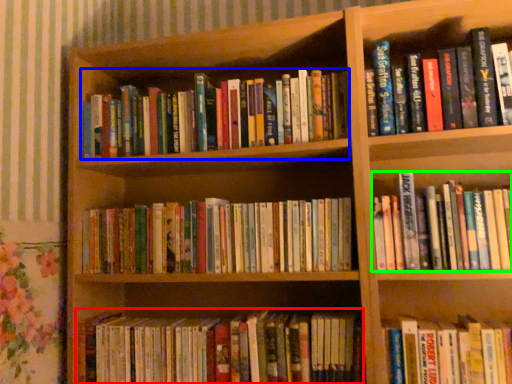
Question: Considering the real-world distances, which object is closest to book (highlighted by a red box)? book (highlighted by a blue box) or book (highlighted by a green box).

Choices:
 (A) book
 (B) book

Answer: (B)